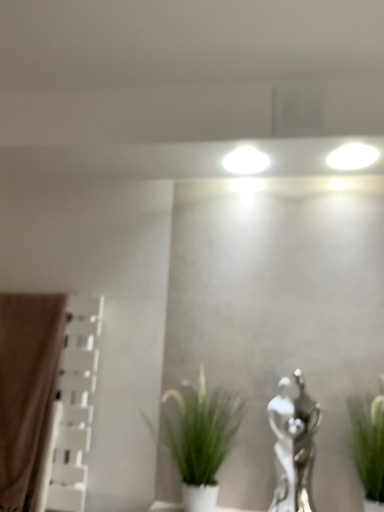
Question: Does silver metallic statue at center-right have a greater height compared to green matte plant at center, arranged as the second houseplant when viewed from the right?

Choices:
 (A) no
 (B) yes

Answer: (B)

Question: Does silver metallic statue at center-right have a larger size compared to green matte plant at center, the first houseplant when ordered from left to right?

Choices:
 (A) yes
 (B) no

Answer: (B)

Question: Does silver metallic statue at center-right come in front of green matte plant at center, arranged as the second houseplant when viewed from the right?

Choices:
 (A) no
 (B) yes

Answer: (A)

Question: Is silver metallic statue at center-right oriented away from green matte plant at center, arranged as the second houseplant when viewed from the right?

Choices:
 (A) yes
 (B) no

Answer: (B)

Question: Can we say silver metallic statue at center-right lies outside green matte plant at center, arranged as the second houseplant when viewed from the right?

Choices:
 (A) yes
 (B) no

Answer: (A)

Question: Is silver metallic statue at center-right at the right side of green matte plant at center, the first houseplant when ordered from left to right?

Choices:
 (A) yes
 (B) no

Answer: (A)

Question: Is brown fabric curtain at left at the right side of green matte plant at center, arranged as the second houseplant when viewed from the right?

Choices:
 (A) no
 (B) yes

Answer: (A)

Question: Is brown fabric curtain at left positioned before green matte plant at center, the first houseplant when ordered from left to right?

Choices:
 (A) yes
 (B) no

Answer: (B)

Question: Is brown fabric curtain at left positioned behind green matte plant at center, arranged as the second houseplant when viewed from the right?

Choices:
 (A) yes
 (B) no

Answer: (A)

Question: Is brown fabric curtain at left facing away from green matte plant at center, arranged as the second houseplant when viewed from the right?

Choices:
 (A) yes
 (B) no

Answer: (B)

Question: From the image's perspective, does brown fabric curtain at left appear higher than green matte plant at center, the first houseplant when ordered from left to right?

Choices:
 (A) yes
 (B) no

Answer: (A)

Question: Does brown fabric curtain at left have a lesser height compared to green matte plant at center, arranged as the second houseplant when viewed from the right?

Choices:
 (A) yes
 (B) no

Answer: (B)

Question: Does green leafy plant at right, arranged as the first houseplant when viewed from the right, appear on the right side of brown fabric curtain at left?

Choices:
 (A) no
 (B) yes

Answer: (B)